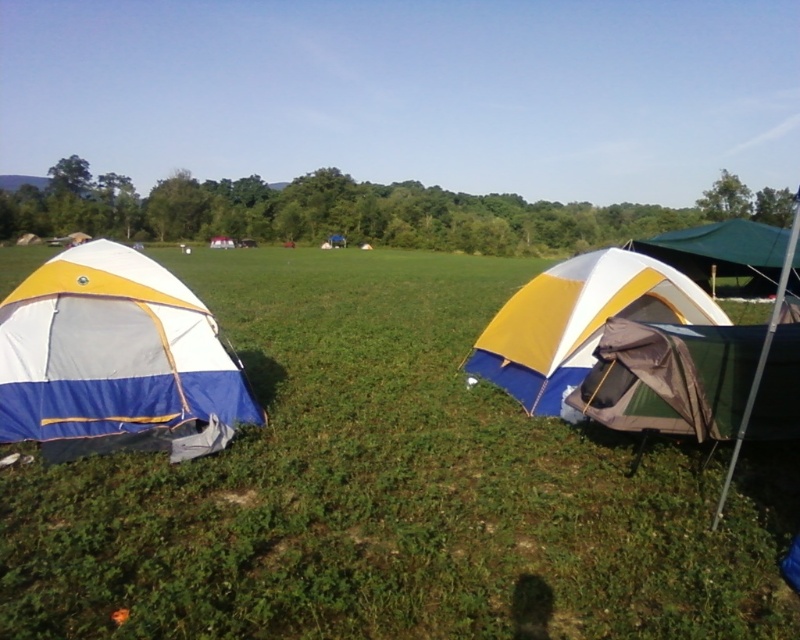
Question: Which object is positioned farthest from the green fabric tent at right?

Choices:
 (A) yellow/white fabric tent at center-right
 (B) green grassy at center
 (C) blue and white canvas tent at left

Answer: (C)

Question: Where is yellow/white fabric tent at center-right located in relation to green fabric tent at right in the image?

Choices:
 (A) left
 (B) right

Answer: (A)

Question: From the image, what is the correct spatial relationship of green grassy at center in relation to blue and white canvas tent at left?

Choices:
 (A) below
 (B) above

Answer: (B)

Question: Is blue and white canvas tent at left positioned in front of green fabric tent at right?

Choices:
 (A) yes
 (B) no

Answer: (A)

Question: Which point is farther from the camera taking this photo?

Choices:
 (A) (272, 371)
 (B) (112, 300)

Answer: (A)

Question: Which object is the farthest from the blue and white canvas tent at left?

Choices:
 (A) green fabric tent at right
 (B) green grassy at center

Answer: (A)